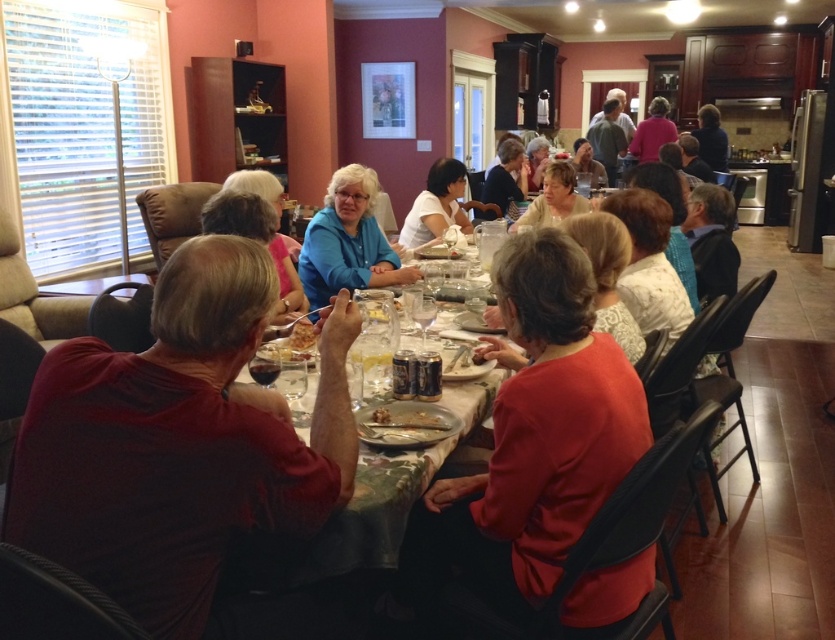
You are sitting at the dining table and notice two shirts at the center of the table. Which shirt is nearer to you, the matte red shirt at center or the blue matte shirt at center?

The matte red shirt at center is closer to the viewer than the blue matte shirt at center, so the matte red shirt at center is nearer to you.

You are a guest at the gathering and want to greet the person wearing the blue matte shirt at center without disturbing the person in the matte red shirt at center. Which direction should you approach from?

You should approach from the left side of the blue matte shirt at center since the matte red shirt at center is on its right, so moving from the left would avoid the other person.

You are a guest at the family gathering and want to find the dark red shirt at left. Where should you look in the room?

The dark red shirt at left is located at point 0.692 on the x axis and 0.213 on the y axis.